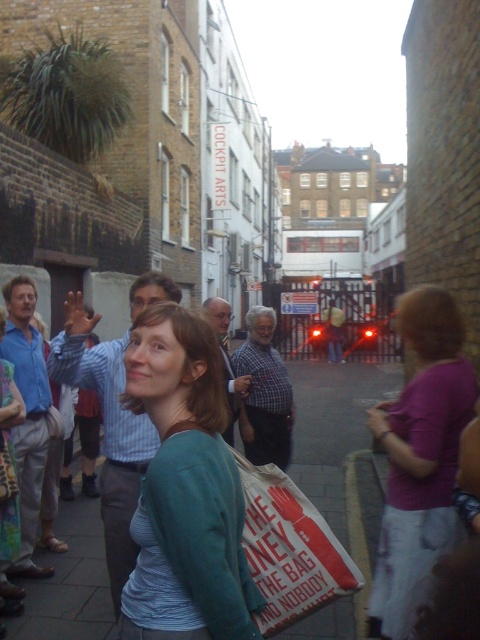
You are standing at the camera position and want to reach the point marked at coordinates (453, 508). Considering the alleyway is 10 feet wide, can you walk straight to that point without crossing the centerline?

The point marked at coordinates (453, 508) is 9.01 feet away from the camera. Since the alleyway is 10 feet wide, walking straight to the point would require staying within your side of the alley, so yes, you can reach it without crossing the centerline as the distance is less than half the alley width.